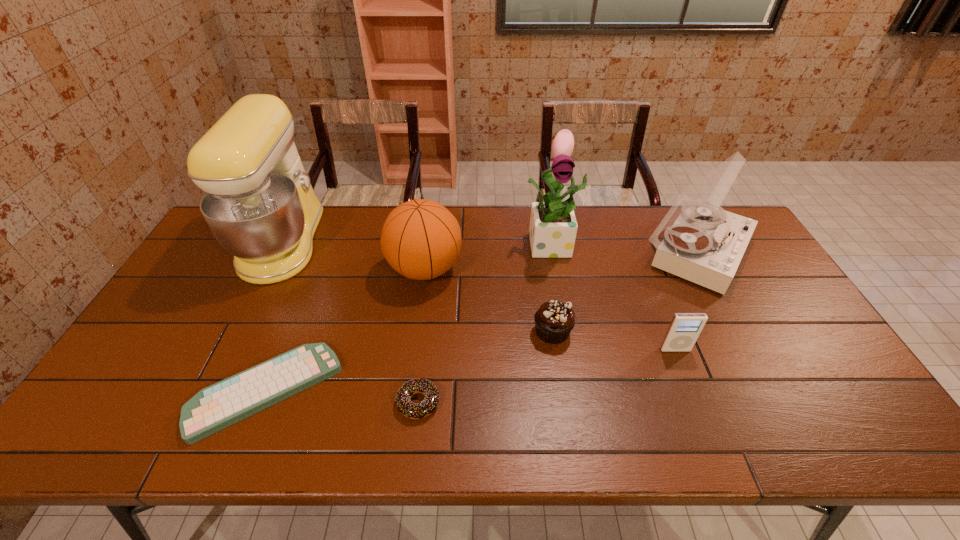
Locate which object is the sixth closest to the mixer. Please provide its 2D coordinates. Your answer should be formatted as a tuple, i.e. [(x, y)], where the tuple contains the x and y coordinates of a point satisfying the conditions above.

[(684, 329)]

Point out which object is positioned as the third nearest to the third tallest object. Please provide its 2D coordinates. Your answer should be formatted as a tuple, i.e. [(x, y)], where the tuple contains the x and y coordinates of a point satisfying the conditions above.

[(555, 319)]

Identify the location of free spot that satisfies the following two spatial constraints: 1. on the side of the shortest object with the control knob; 2. on the right side of the mixer. The image size is (960, 540). (208, 392).

You are a GUI agent. You are given a task and a screenshot of the screen. Output one action in this format:
    pyautogui.click(x=<x>, y=<y>)
    Task: Click on the vacant position in the image that satisfies the following two spatial constraints: 1. on the side of the shortest object with the control knob; 2. on the right side of the mixer
    This screenshot has width=960, height=540.
    Given the screenshot: What is the action you would take?
    pyautogui.click(x=208, y=392)

This screenshot has width=960, height=540. I want to click on vacant space that satisfies the following two spatial constraints: 1. on the back side of the computer keyboard; 2. on the side of the mixer with the control knob, so click(x=325, y=242).

Locate an element on the screen. free space that satisfies the following two spatial constraints: 1. on the side of the mixer with the control knob; 2. on the back side of the cupcake is located at coordinates (239, 332).